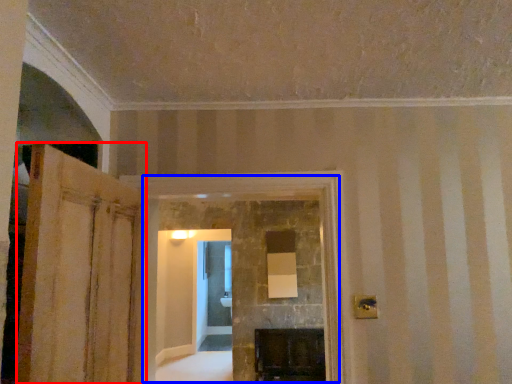
Question: Among these objects, which one is nearest to the camera, door (highlighted by a red box) or fireplace (highlighted by a blue box)?

Choices:
 (A) door
 (B) fireplace

Answer: (A)